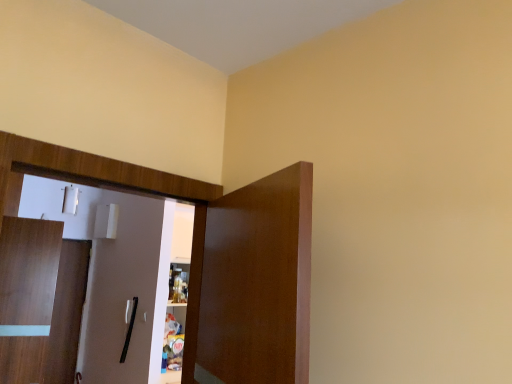
Question: In terms of width, does wooden door at left, which is the second door in right-to-left order, look wider or thinner when compared to wooden dresser at left?

Choices:
 (A) wide
 (B) thin

Answer: (B)

Question: Is wooden door at left, acting as the first door starting from the bottom, bigger or smaller than wooden dresser at left?

Choices:
 (A) small
 (B) big

Answer: (A)

Question: Based on their relative distances, which object is farther from the brown wooden door at center, the first door viewed from the right?

Choices:
 (A) wooden dresser at left
 (B) wooden door at left, the 2th door when ordered from front to back

Answer: (B)

Question: Which of these objects is positioned farthest from the brown wooden door at center, which is counted as the second door, starting from the back?

Choices:
 (A) wooden dresser at left
 (B) wooden door at left, which ranks as the 1th door in left-to-right order

Answer: (B)